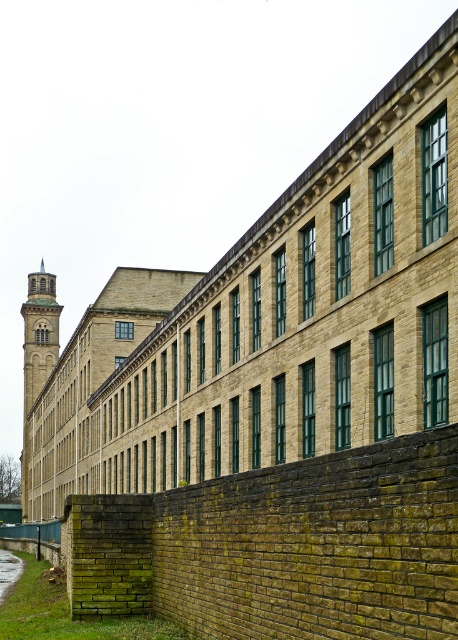
Does stone clock tower at left have a greater width compared to green grass at lower left?

Yes, stone clock tower at left is wider than green grass at lower left.

Based on the photo, which is below, stone clock tower at left or green grass at lower left?

green grass at lower left

Where is `stone clock tower at left`? This screenshot has width=458, height=640. stone clock tower at left is located at coordinates (37, 353).